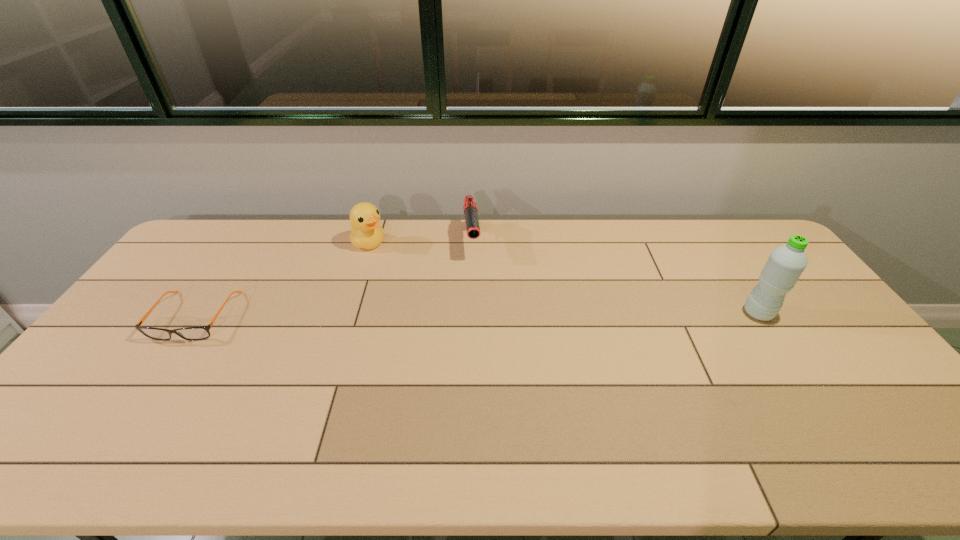
Image resolution: width=960 pixels, height=540 pixels. Identify the location of the leftmost object. (190, 333).

Image resolution: width=960 pixels, height=540 pixels. I want to click on the shortest object, so (x=190, y=333).

Locate an element on the screen. the rightmost object is located at coordinates (786, 263).

Identify the location of the tallest object. This screenshot has width=960, height=540. (786, 263).

Locate an element on the screen. Image resolution: width=960 pixels, height=540 pixels. the third object from right to left is located at coordinates (366, 233).

Image resolution: width=960 pixels, height=540 pixels. Find the location of `gun`. gun is located at coordinates (470, 207).

What are the coordinates of `vacant space located on the front-facing side of the shortest object` in the screenshot? It's located at (132, 409).

Where is `free space located 0.360m on the left of the tallest object`? This screenshot has width=960, height=540. free space located 0.360m on the left of the tallest object is located at coordinates (623, 313).

You are a GUI agent. You are given a task and a screenshot of the screen. Output one action in this format:
    pyautogui.click(x=<x>, y=<y>)
    Task: Click on the free space located 0.080m on the face of the third object from right to left
    The height and width of the screenshot is (540, 960).
    Given the screenshot: What is the action you would take?
    pyautogui.click(x=392, y=260)

This screenshot has width=960, height=540. Identify the location of vacant space located on the face of the third object from right to left. (444, 299).